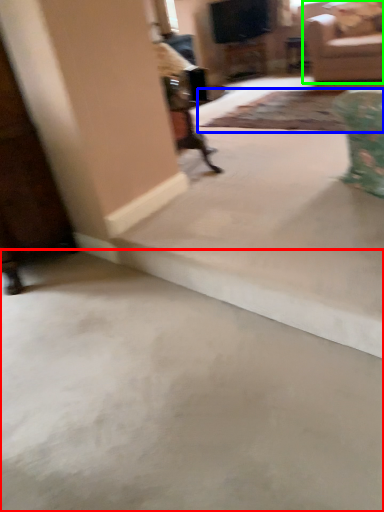
Question: Estimate the real-world distances between objects in this image. Which object is closer to concrete (highlighted by a red box), mat (highlighted by a blue box) or studio couch (highlighted by a green box)?

Choices:
 (A) mat
 (B) studio couch

Answer: (A)